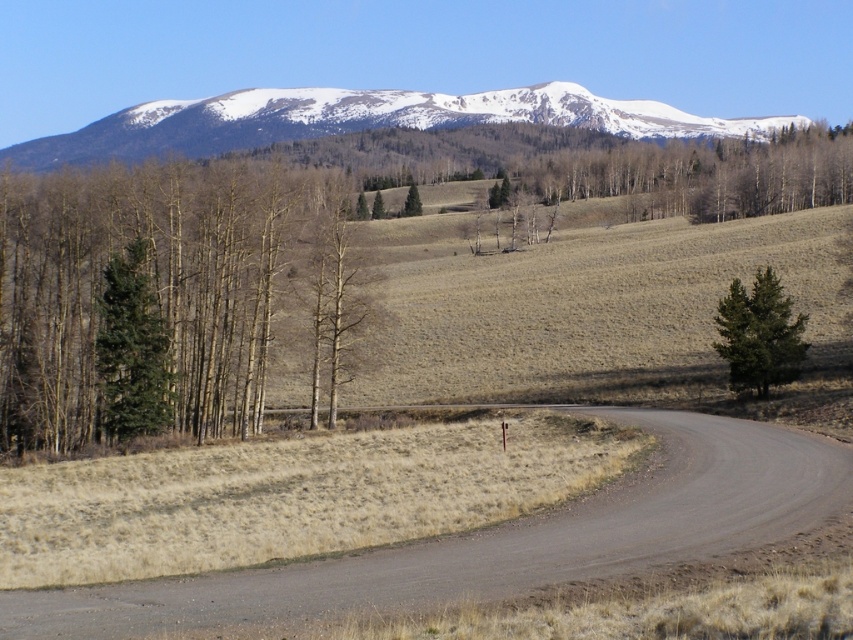
Does green matte tree at left have a smaller size compared to green textured tree at right?

Incorrect, green matte tree at left is not smaller in size than green textured tree at right.

Between point (16, 401) and point (724, 317), which one is positioned behind?

Positioned behind is point (16, 401).

This screenshot has width=853, height=640. I want to click on green matte tree at left, so click(146, 298).

Between green matte evergreen tree at left and green textured tree at right, which one is positioned higher?

green textured tree at right is higher up.

Does green matte evergreen tree at left come behind green textured tree at right?

That is True.

This screenshot has height=640, width=853. Find the location of `green matte evergreen tree at left`. green matte evergreen tree at left is located at coordinates (132, 349).

Between green matte evergreen tree at left and green matte tree at center, which one has more height?

Standing taller between the two is green matte evergreen tree at left.

What do you see at coordinates (132, 349) in the screenshot?
I see `green matte evergreen tree at left` at bounding box center [132, 349].

Locate an element on the screen. The image size is (853, 640). green matte evergreen tree at left is located at coordinates (132, 349).